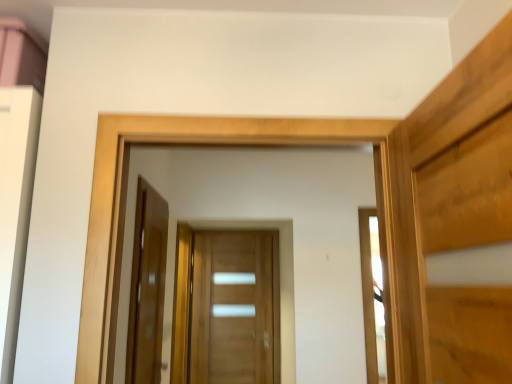
Question: From the image's perspective, is glossy wood door at center, placed as the 1th door when sorted from left to right, positioned above or below wooden door at center, positioned as the second door in left-to-right order?

Choices:
 (A) above
 (B) below

Answer: (A)

Question: Is glossy wood door at center, placed as the 1th door when sorted from front to back, inside or outside of wooden door at center, positioned as the second door in left-to-right order?

Choices:
 (A) outside
 (B) inside

Answer: (A)

Question: Relative to wooden door at center, the 2th door in the front-to-back sequence, is glossy wood door at center, placed as the 1th door when sorted from front to back, in front or behind?

Choices:
 (A) behind
 (B) front

Answer: (B)

Question: Looking at their shapes, would you say wooden door at center, positioned as the second door in left-to-right order, is wider or thinner than glossy wood door at center, the second door in the right-to-left sequence?

Choices:
 (A) wide
 (B) thin

Answer: (A)

Question: Considering the positions of wooden door at center, the first door from the back, and glossy wood door at center, placed as the 1th door when sorted from left to right, in the image, is wooden door at center, the first door from the back, taller or shorter than glossy wood door at center, placed as the 1th door when sorted from left to right,?

Choices:
 (A) short
 (B) tall

Answer: (B)

Question: Does point (234, 321) appear closer or farther from the camera than point (150, 337)?

Choices:
 (A) closer
 (B) farther

Answer: (B)

Question: From a real-world perspective, is wooden door at center, positioned as the second door in left-to-right order, above or below glossy wood door at center, the 2th door from the back?

Choices:
 (A) below
 (B) above

Answer: (A)